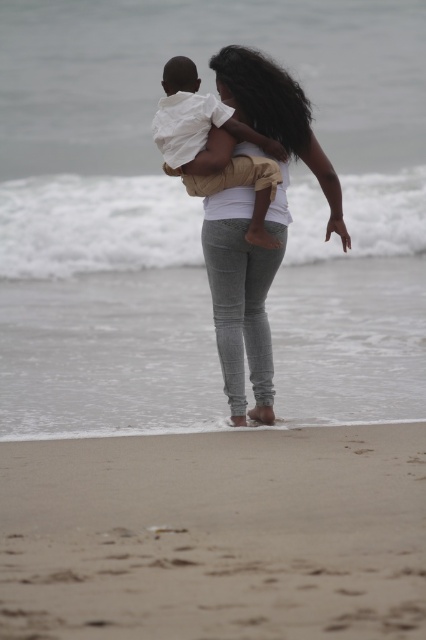
Does sandy beach at lower center have a larger size compared to white cotton shirt at center?

Indeed, sandy beach at lower center has a larger size compared to white cotton shirt at center.

Is sandy beach at lower center behind white cotton shirt at center?

No, it is not.

Who is more distant from viewer, (213, 492) or (166, 129)?

The point (166, 129) is more distant.

Where is `sandy beach at lower center`? The image size is (426, 640). sandy beach at lower center is located at coordinates (215, 534).

Does point (224, 292) come behind point (271, 180)?

Yes.

Who is more forward, (285, 230) or (158, 124)?

Positioned in front is point (158, 124).

Which is in front, point (250, 189) or point (241, 172)?

Point (241, 172)

Locate an element on the screen. The width and height of the screenshot is (426, 640). gray textured pants at center is located at coordinates (242, 296).

Is sandy beach at lower center below gray textured pants at center?

Correct, sandy beach at lower center is located below gray textured pants at center.

In order to click on sandy beach at lower center in this screenshot , I will do `click(215, 534)`.

The image size is (426, 640). What do you see at coordinates (215, 534) in the screenshot?
I see `sandy beach at lower center` at bounding box center [215, 534].

The image size is (426, 640). I want to click on sandy beach at lower center, so click(x=215, y=534).